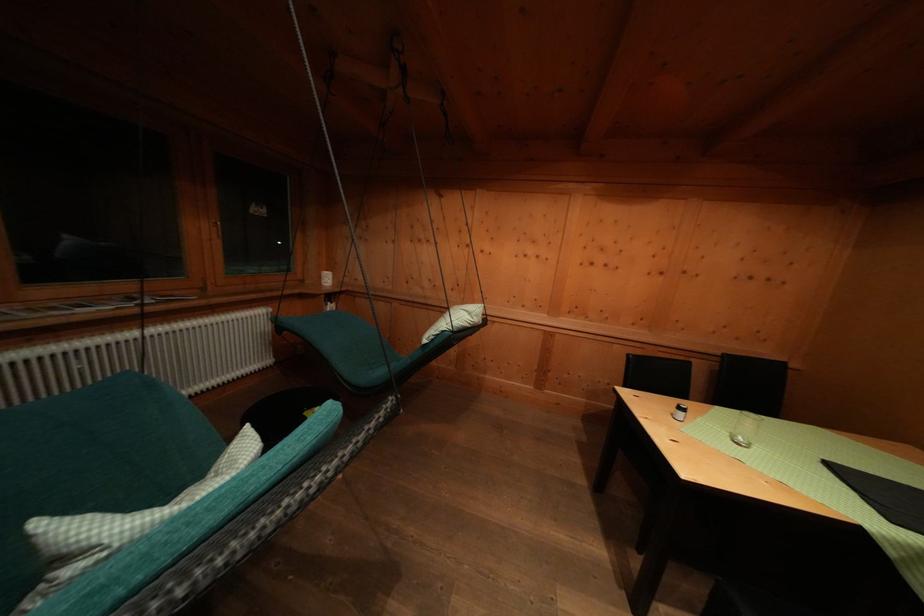
Image resolution: width=924 pixels, height=616 pixels. What do you see at coordinates (54, 444) in the screenshot? I see `the turquoise chair armrest` at bounding box center [54, 444].